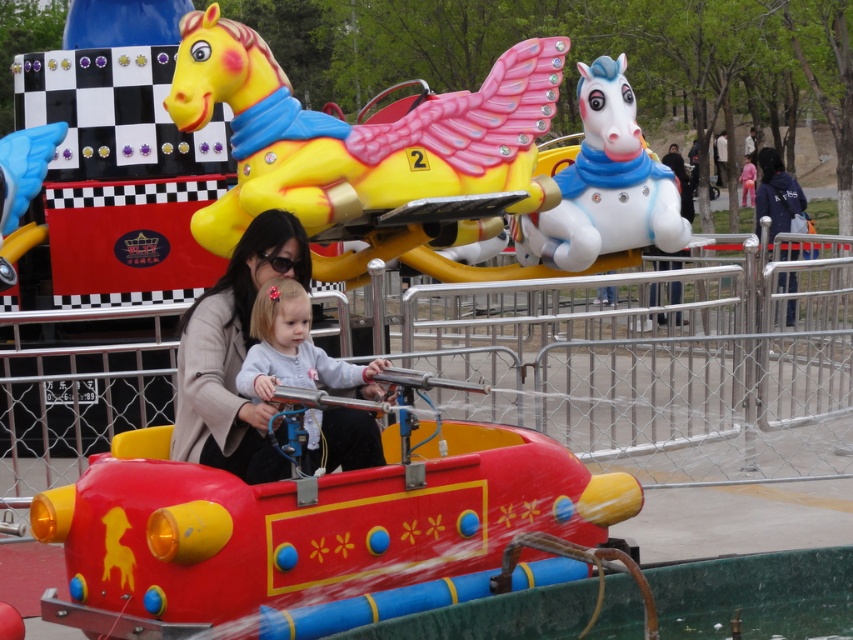
You are a park visitor trying to take a photo of the white glossy horse at upper center and the light gray fleece jacket at center. Which object should you focus on first if you want to capture both in the same frame without moving your camera?

The white glossy horse at upper center is wider than the light gray fleece jacket at center, so you should focus on the white glossy horse at upper center first to ensure it fits in the frame.

You are a parent trying to locate your child who is sitting on the light gray fleece jacket at center. You see the yellow matte plastic horse at upper center. In which direction should you look to find your child?

The yellow matte plastic horse at upper center is to the right of the light gray fleece jacket at center, so you should look to the left to find your child.

You are standing in the amusement park and want to take a photo of both the yellow matte plastic horse at upper center and the matte beige coat at center. Where should you position yourself to capture both in the frame?

Position yourself to the left of the matte beige coat at center so that the yellow matte plastic horse at upper center, which is to the right of the matte beige coat at center, stays within the frame.